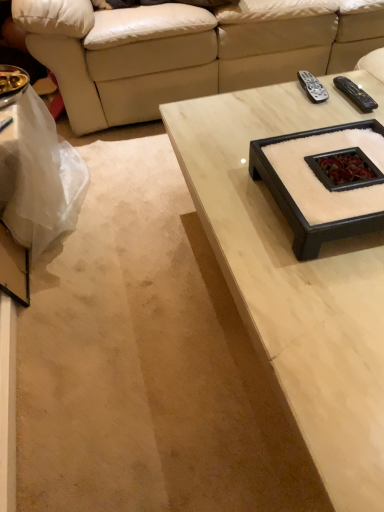
Question: Is black plastic remote at upper right, arranged as the second remote when viewed from the right, thinner than white plastic bag at lower left?

Choices:
 (A) yes
 (B) no

Answer: (A)

Question: Does black plastic remote at upper right, arranged as the second remote when viewed from the right, appear on the left side of white plastic bag at lower left?

Choices:
 (A) yes
 (B) no

Answer: (B)

Question: Does black plastic remote at upper right, placed as the 1th remote when sorted from left to right, have a lesser height compared to white plastic bag at lower left?

Choices:
 (A) no
 (B) yes

Answer: (B)

Question: Does black plastic remote at upper right, arranged as the second remote when viewed from the right, touch white plastic bag at lower left?

Choices:
 (A) no
 (B) yes

Answer: (A)

Question: Can you confirm if black plastic remote at upper right, arranged as the second remote when viewed from the right, is wider than white plastic bag at lower left?

Choices:
 (A) yes
 (B) no

Answer: (B)

Question: Considering the positions of point (364, 426) and point (36, 141), is point (364, 426) closer or farther from the camera than point (36, 141)?

Choices:
 (A) closer
 (B) farther

Answer: (A)

Question: Considering the positions of white marble coffee table at upper center and white plastic bag at lower left in the image, is white marble coffee table at upper center bigger or smaller than white plastic bag at lower left?

Choices:
 (A) big
 (B) small

Answer: (A)

Question: Relative to white plastic bag at lower left, is white marble coffee table at upper center in front or behind?

Choices:
 (A) behind
 (B) front

Answer: (B)

Question: From the image's perspective, is white marble coffee table at upper center above or below white plastic bag at lower left?

Choices:
 (A) below
 (B) above

Answer: (A)

Question: Is black plastic remote at upper right, acting as the 2th remote starting from the left, in front of or behind white marble coffee table at upper center in the image?

Choices:
 (A) behind
 (B) front

Answer: (A)

Question: Looking at their shapes, would you say black plastic remote at upper right, arranged as the 1th remote when viewed from the right, is wider or thinner than white marble coffee table at upper center?

Choices:
 (A) wide
 (B) thin

Answer: (B)

Question: Is black plastic remote at upper right, acting as the 2th remote starting from the left, inside or outside of white marble coffee table at upper center?

Choices:
 (A) outside
 (B) inside

Answer: (A)

Question: Is black plastic remote at upper right, acting as the 2th remote starting from the left, taller or shorter than white marble coffee table at upper center?

Choices:
 (A) short
 (B) tall

Answer: (A)

Question: Which is correct: black plastic remote at upper right, acting as the 2th remote starting from the left, is inside white plastic bag at lower left, or outside of it?

Choices:
 (A) outside
 (B) inside

Answer: (A)

Question: In terms of width, does black plastic remote at upper right, arranged as the 1th remote when viewed from the right, look wider or thinner when compared to white plastic bag at lower left?

Choices:
 (A) thin
 (B) wide

Answer: (A)